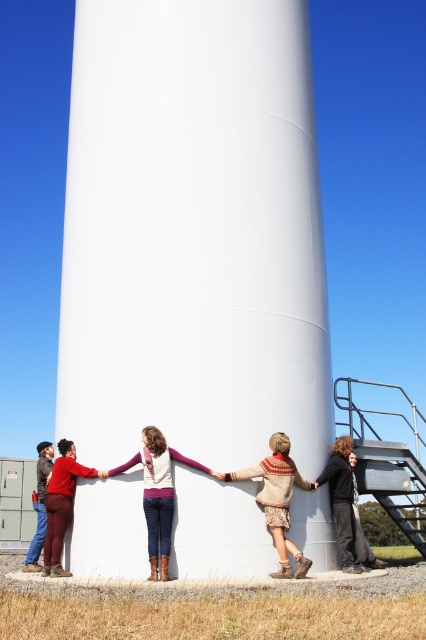
Does knitted sweater at center lie behind dark gray sweater at lower right?

No, knitted sweater at center is closer to the viewer.

Between point (296, 474) and point (371, 566), which one is positioned behind?

Point (371, 566)

Find the location of `knitted sweater at center`. knitted sweater at center is located at coordinates (276, 499).

Is point (172, 452) positioned behind point (333, 512)?

No, (172, 452) is in front of (333, 512).

Can you confirm if matte purple sweater at center is bigger than dark gray sweater at lower right?

Incorrect, matte purple sweater at center is not larger than dark gray sweater at lower right.

Where is `matte purple sweater at center`? The image size is (426, 640). matte purple sweater at center is located at coordinates (158, 493).

Locate an element on the screen. The width and height of the screenshot is (426, 640). matte purple sweater at center is located at coordinates (158, 493).

Does point (256, 257) lie behind point (163, 484)?

Yes, point (256, 257) is farther from viewer.

This screenshot has height=640, width=426. What do you see at coordinates (192, 234) in the screenshot?
I see `white smooth water tower at center` at bounding box center [192, 234].

I want to click on white smooth water tower at center, so click(x=192, y=234).